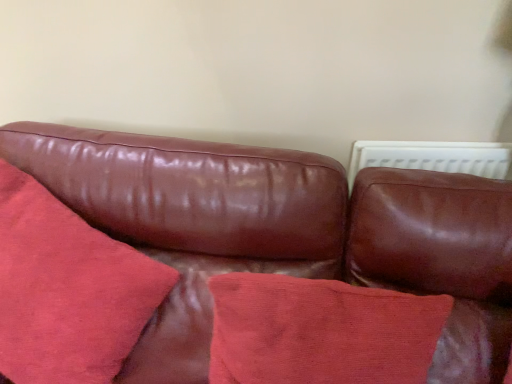
Question: From the image's perspective, is suede-like red pillow at center, which is the 1th throw pillow from left to right, positioned above or below leather couch at center?

Choices:
 (A) above
 (B) below

Answer: (A)

Question: Relative to leather couch at center, is suede-like red pillow at center, which is the 2th throw pillow in right-to-left order, in front or behind?

Choices:
 (A) behind
 (B) front

Answer: (A)

Question: Estimate the real-world distances between objects in this image. Which object is farther from the suede-like red pillow at center, which is the 1th throw pillow from left to right?

Choices:
 (A) cotton cushion at center, which is the second throw pillow from left to right
 (B) leather couch at center

Answer: (A)

Question: Estimate the real-world distances between objects in this image. Which object is farther from the suede-like red pillow at center, which is the 1th throw pillow from left to right?

Choices:
 (A) leather couch at center
 (B) cotton cushion at center, which is the second throw pillow from left to right

Answer: (B)